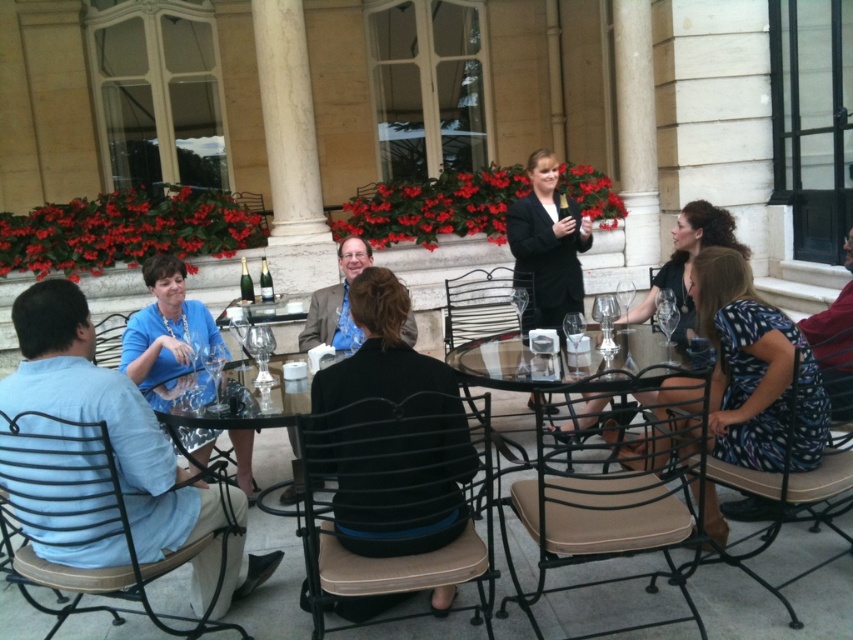
You are organizing a photo shoot and need to ensure that all participants are visible in the group photo. Considering the sizes of the light blue shirt at left and the matte brown suit at center, which participant should be positioned closer to the camera to ensure both are equally visible?

The light blue shirt at left is bigger than the matte brown suit at center, so the matte brown suit at center should be positioned closer to the camera to balance their visibility.

You are a photographer trying to capture a candid shot of the matte brown suit at center without including the light blue shirt at left in the frame. Given their current positions, is this possible?

The light blue shirt at left is positioned under the matte brown suit at center, meaning the matte brown suit is above it. Since the photographer can adjust the camera angle to focus on the upper area where the matte brown suit at center is located, it is possible to capture the matte brown suit at center without including the light blue shirt at left in the frame.

You are a photographer at this event and need to ensure everyone is visible in the group photo. The matte brown suit at center is seated closer to the camera than the light blue shirt at left. Which person should you ask to lean forward slightly to ensure both are in focus?

You should ask the light blue shirt at left to lean forward because they are taller than the matte brown suit at center and seated farther from the camera, so leaning forward will help both be in focus.